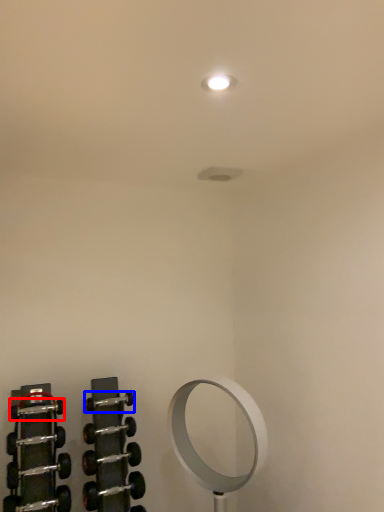
Question: Which point is closer to the camera, dumbbell (highlighted by a red box) or dumbbell (highlighted by a blue box)?

Choices:
 (A) dumbbell
 (B) dumbbell

Answer: (A)